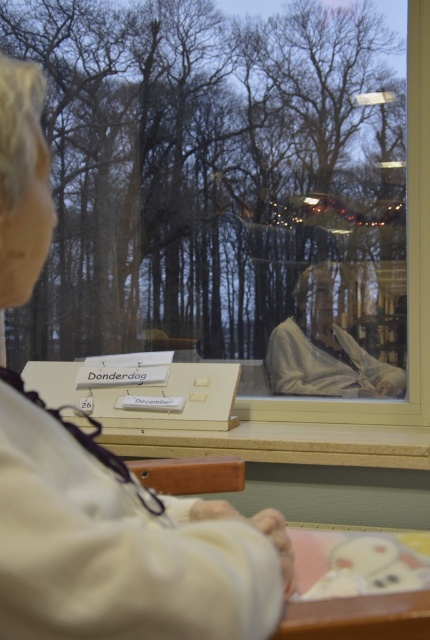
Can you confirm if transparent glass window at center is positioned to the right of white fabric person at center?

Indeed, transparent glass window at center is positioned on the right side of white fabric person at center.

The height and width of the screenshot is (640, 430). Find the location of `transparent glass window at center`. transparent glass window at center is located at coordinates (237, 198).

This screenshot has width=430, height=640. What do you see at coordinates (120, 545) in the screenshot?
I see `white fabric person at center` at bounding box center [120, 545].

Between white fabric person at center and white fabric at center, which one has less height?

white fabric at center

Is point (122, 483) positioned behind point (315, 304)?

No, it is not.

In order to click on white fabric person at center in this screenshot , I will do `click(120, 545)`.

Is transparent glass window at center wider than white fabric at center?

Yes.

From the picture: Can you confirm if transparent glass window at center is bigger than white fabric at center?

Indeed, transparent glass window at center has a larger size compared to white fabric at center.

Does point (178, 195) come behind point (398, 289)?

That is True.

Identify the location of transparent glass window at center. This screenshot has height=640, width=430. (237, 198).